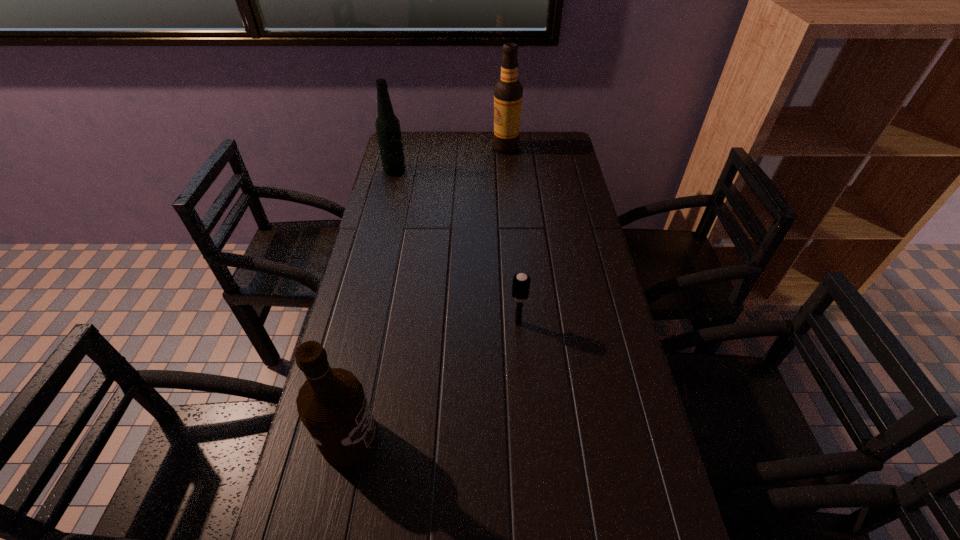
Find the location of a particular element. The height and width of the screenshot is (540, 960). alcohol that stands as the second closest to the shortest object is located at coordinates (387, 125).

The width and height of the screenshot is (960, 540). In order to click on free location that satisfies the following two spatial constraints: 1. on the label of the farthest alcohol; 2. on the front side of the hairbrush in this screenshot , I will do `click(519, 323)`.

You are a GUI agent. You are given a task and a screenshot of the screen. Output one action in this format:
    pyautogui.click(x=<x>, y=<y>)
    Task: Click on the vacant space that satisfies the following two spatial constraints: 1. on the label of the farthest alcohol; 2. on the front side of the shortest object
    The width and height of the screenshot is (960, 540).
    Given the screenshot: What is the action you would take?
    pyautogui.click(x=519, y=323)